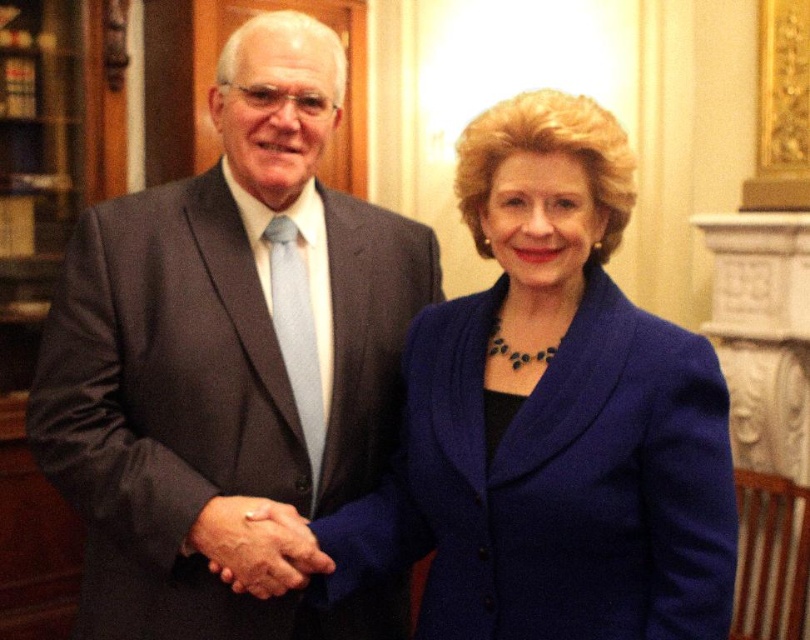
Between matte gray suit at center and smooth skin handshake at center, which one is positioned higher?

matte gray suit at center is higher up.

Which of these two, matte gray suit at center or smooth skin handshake at center, stands shorter?

smooth skin handshake at center is shorter.

Does point (291, 580) come in front of point (284, 518)?

Yes, point (291, 580) is in front of point (284, 518).

Locate an element on the screen. This screenshot has width=810, height=640. matte gray suit at center is located at coordinates (229, 364).

Is blue woolen blazer at center closer to the viewer compared to smooth skin handshake at center?

That is True.

Which is more to the left, blue woolen blazer at center or smooth skin handshake at center?

smooth skin handshake at center

Is point (627, 195) farther from camera compared to point (258, 595)?

No, (627, 195) is in front of (258, 595).

Find the location of a particular element. The image size is (810, 640). blue woolen blazer at center is located at coordinates (561, 412).

Can you confirm if matte gray suit at center is thinner than blue woolen blazer at center?

In fact, matte gray suit at center might be wider than blue woolen blazer at center.

Looking at this image, which is below, matte gray suit at center or blue woolen blazer at center?

blue woolen blazer at center

Locate an element on the screen. The height and width of the screenshot is (640, 810). matte gray suit at center is located at coordinates (229, 364).